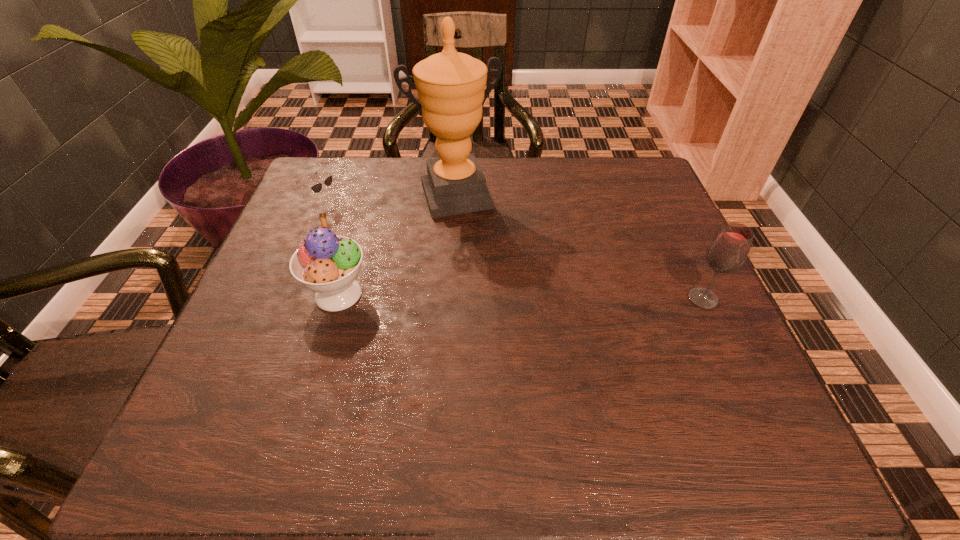
In order to click on icecream in this screenshot , I will do `click(328, 264)`.

The image size is (960, 540). What are the coordinates of `the rightmost object` in the screenshot? It's located at (728, 251).

Where is `the shortest object`? The height and width of the screenshot is (540, 960). the shortest object is located at coordinates (316, 188).

Find the location of a particular element. award is located at coordinates (451, 90).

The width and height of the screenshot is (960, 540). Find the location of `the tallest object`. the tallest object is located at coordinates (451, 90).

You are a GUI agent. You are given a task and a screenshot of the screen. Output one action in this format:
    pyautogui.click(x=<x>, y=<y>)
    Task: Click on the vacant space positioned 0.090m on the front of the icecream
    The width and height of the screenshot is (960, 540).
    Given the screenshot: What is the action you would take?
    pyautogui.click(x=319, y=360)

Locate an element on the screen. vacant space located 0.090m on the left of the glass drink container is located at coordinates (642, 299).

The image size is (960, 540). Find the location of `vacant region located 0.320m in front of the lenses of the shortest object`. vacant region located 0.320m in front of the lenses of the shortest object is located at coordinates (442, 267).

At what (x,y) coordinates should I click in order to perform the action: click on vacant space located in front of the lenses of the shortest object. Please return your answer as a coordinate pair (x, y). Looking at the image, I should click on (472, 284).

Identify the location of free space located in front of the lenses of the shortest object. (407, 249).